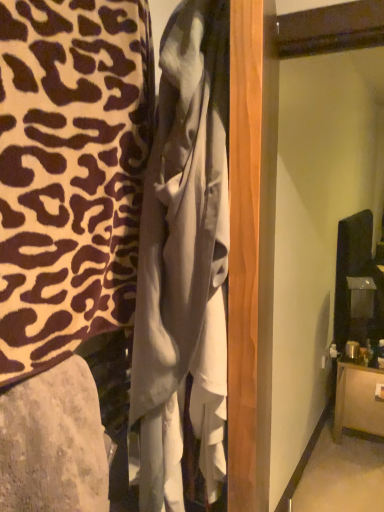
Question: Considering the relative sizes of leopard print fabric at left, arranged as the 1th furniture when viewed from the top, and brown wood cabinet at lower right, the third furniture in the front-to-back sequence, in the image provided, is leopard print fabric at left, arranged as the 1th furniture when viewed from the top, smaller than brown wood cabinet at lower right, the third furniture in the front-to-back sequence,?

Choices:
 (A) no
 (B) yes

Answer: (B)

Question: Is leopard print fabric at left, arranged as the 1th furniture when viewed from the top, to the right of brown wood cabinet at lower right, the 1th furniture when ordered from back to front, from the viewer's perspective?

Choices:
 (A) yes
 (B) no

Answer: (B)

Question: Would you say leopard print fabric at left, the first furniture when ordered from left to right, contains brown wood cabinet at lower right, the 1th furniture positioned from the right?

Choices:
 (A) no
 (B) yes

Answer: (A)

Question: Is leopard print fabric at left, the 2th furniture in the back-to-front sequence, further to camera compared to brown wood cabinet at lower right, the 1th furniture when ordered from back to front?

Choices:
 (A) no
 (B) yes

Answer: (A)

Question: Is leopard print fabric at left, marked as the 3th furniture in a bottom-to-top arrangement, positioned in front of brown wood cabinet at lower right, the 1th furniture positioned from the bottom?

Choices:
 (A) yes
 (B) no

Answer: (A)

Question: Is leopard print fabric at left, placed as the third furniture when sorted from right to left, thinner than brown wood cabinet at lower right, the third furniture in the front-to-back sequence?

Choices:
 (A) no
 (B) yes

Answer: (B)

Question: Is matte gray fabric at lower left, the 2th furniture positioned from the top, beside brown wood cabinet at lower right, the third furniture in the front-to-back sequence?

Choices:
 (A) no
 (B) yes

Answer: (A)

Question: From the image's perspective, is matte gray fabric at lower left, positioned as the second furniture in right-to-left order, under brown wood cabinet at lower right, the third furniture in the front-to-back sequence?

Choices:
 (A) yes
 (B) no

Answer: (B)

Question: Considering the relative positions of matte gray fabric at lower left, which is the 1th furniture in front-to-back order, and brown wood cabinet at lower right, the 1th furniture when ordered from back to front, in the image provided, is matte gray fabric at lower left, which is the 1th furniture in front-to-back order, to the right of brown wood cabinet at lower right, the 1th furniture when ordered from back to front, from the viewer's perspective?

Choices:
 (A) yes
 (B) no

Answer: (B)

Question: Considering the relative sizes of matte gray fabric at lower left, which is the 3th furniture from back to front, and brown wood cabinet at lower right, the 1th furniture positioned from the right, in the image provided, is matte gray fabric at lower left, which is the 3th furniture from back to front, bigger than brown wood cabinet at lower right, the 1th furniture positioned from the right,?

Choices:
 (A) yes
 (B) no

Answer: (B)

Question: Can you confirm if matte gray fabric at lower left, which is the 1th furniture in front-to-back order, is shorter than brown wood cabinet at lower right, the 1th furniture when ordered from back to front?

Choices:
 (A) no
 (B) yes

Answer: (B)

Question: From a real-world perspective, is matte gray fabric at lower left, the 2th furniture positioned from the top, positioned under brown wood cabinet at lower right, which is the third furniture in left-to-right order, based on gravity?

Choices:
 (A) yes
 (B) no

Answer: (B)

Question: Is white satin dress at center touching matte gray fabric at lower left, positioned as the second furniture in bottom-to-top order?

Choices:
 (A) no
 (B) yes

Answer: (A)